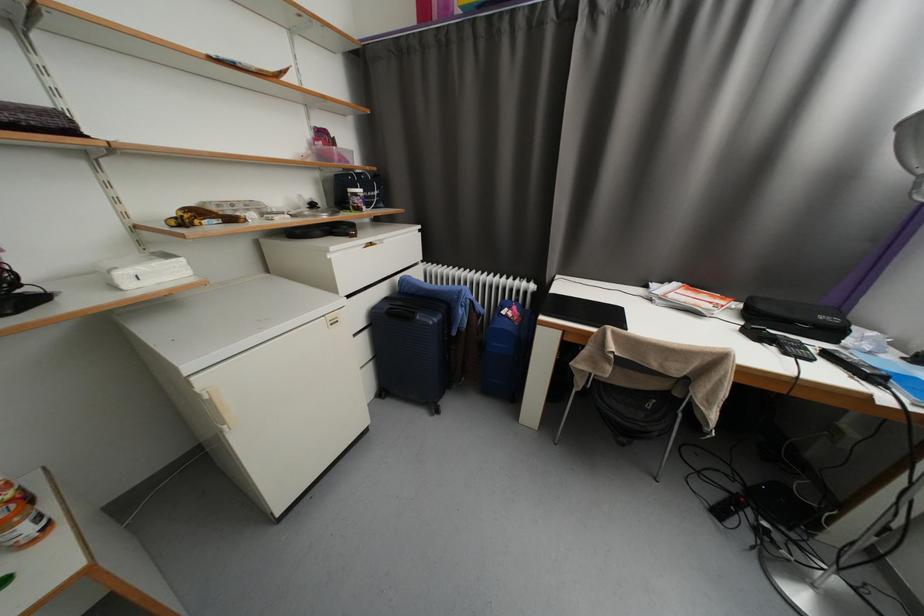
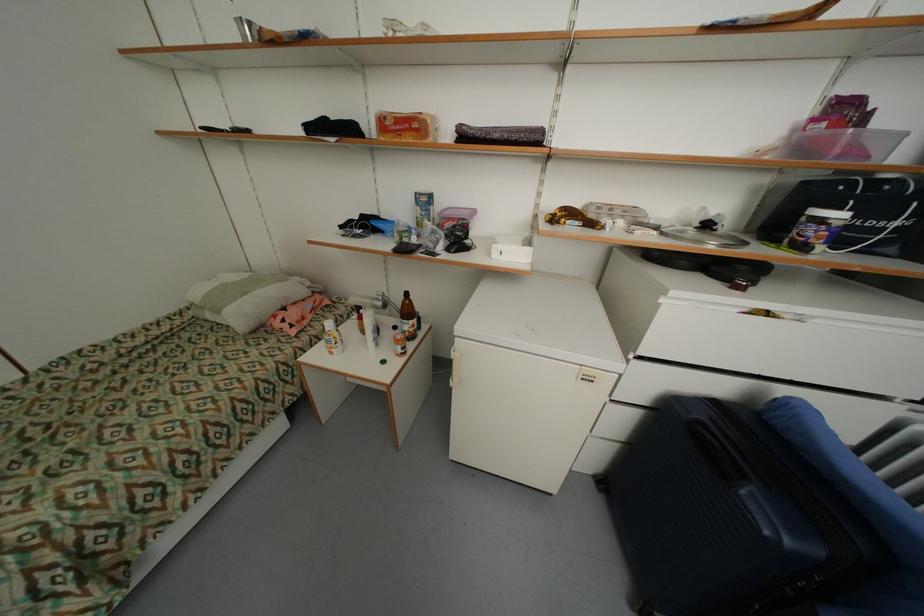
Find the pixel in the second image that matches (x=383, y=400) in the first image.

(599, 483)